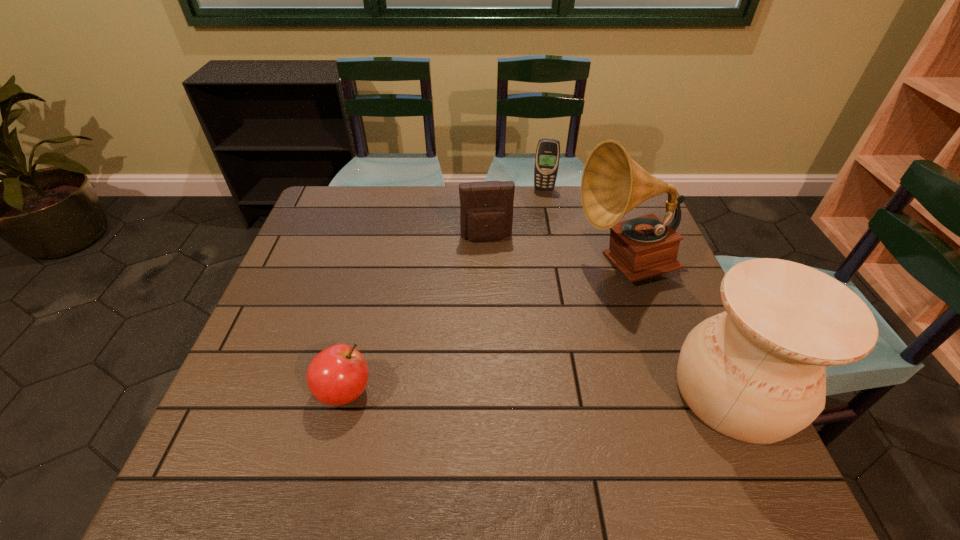
I want to click on the leftmost object, so click(338, 375).

Where is `the shortest object`? The height and width of the screenshot is (540, 960). the shortest object is located at coordinates (338, 375).

Find the location of a particular element. the fourth shortest object is located at coordinates (756, 373).

The image size is (960, 540). What are the coordinates of `the second object from left to right` in the screenshot? It's located at (486, 207).

Find the location of a particular element. The width and height of the screenshot is (960, 540). the tallest object is located at coordinates click(x=612, y=184).

I want to click on the farthest object, so click(547, 157).

Identify the location of the third object from right to left. The height and width of the screenshot is (540, 960). (547, 157).

Image resolution: width=960 pixels, height=540 pixels. I want to click on free space located on the stem of the shortest object, so 411,392.

At what (x,y) coordinates should I click in order to perform the action: click on vacant space located with an open flap on the second object from left to right. Please return your answer as a coordinate pair (x, y). The image size is (960, 540). Looking at the image, I should click on (500, 313).

Find the location of a particular element. free space located with an open flap on the second object from left to right is located at coordinates (492, 259).